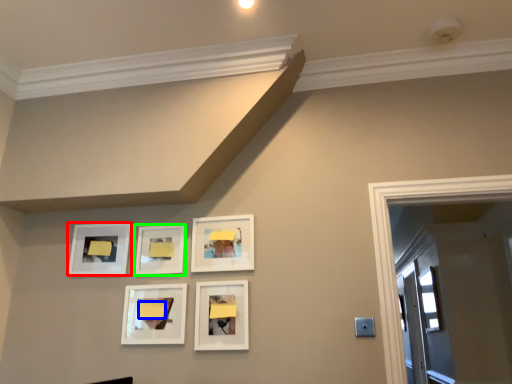
Question: Based on their relative distances, which object is farther from picture frame (highlighted by a red box)? Choose from lift (highlighted by a blue box) and picture frame (highlighted by a green box).

Choices:
 (A) lift
 (B) picture frame

Answer: (A)